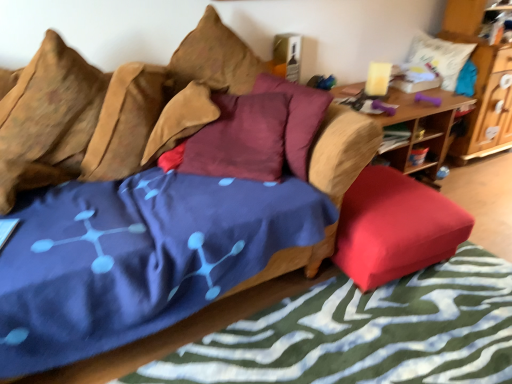
Question: Should I look upward or downward to see blue fabric mattress at center?

Choices:
 (A) down
 (B) up

Answer: (A)

Question: Is blue fabric bed frame at lower left positioned beyond the bounds of textured brown pillow at upper center, which is counted as the third pillow, starting from the right?

Choices:
 (A) no
 (B) yes

Answer: (B)

Question: From the image's perspective, is blue fabric bed frame at lower left beneath textured brown pillow at upper center, which is counted as the third pillow, starting from the right?

Choices:
 (A) yes
 (B) no

Answer: (A)

Question: Is blue fabric bed frame at lower left shorter than textured brown pillow at upper center, the second pillow in the left-to-right sequence?

Choices:
 (A) no
 (B) yes

Answer: (B)

Question: Would you consider blue fabric bed frame at lower left to be distant from textured brown pillow at upper center, the second pillow in the left-to-right sequence?

Choices:
 (A) yes
 (B) no

Answer: (A)

Question: Is blue fabric bed frame at lower left further to camera compared to textured brown pillow at upper center, the second pillow in the left-to-right sequence?

Choices:
 (A) yes
 (B) no

Answer: (B)

Question: Is blue fabric bed frame at lower left taller than textured brown pillow at upper center, which is counted as the third pillow, starting from the right?

Choices:
 (A) yes
 (B) no

Answer: (B)

Question: From a real-world perspective, is textured brown pillow at upper center, the second pillow in the left-to-right sequence, below wooden table at right?

Choices:
 (A) no
 (B) yes

Answer: (A)

Question: Considering the relative sizes of textured brown pillow at upper center, which is counted as the third pillow, starting from the right, and wooden table at right in the image provided, is textured brown pillow at upper center, which is counted as the third pillow, starting from the right, smaller than wooden table at right?

Choices:
 (A) no
 (B) yes

Answer: (B)

Question: From a real-world perspective, is textured brown pillow at upper center, the second pillow in the left-to-right sequence, positioned over wooden table at right based on gravity?

Choices:
 (A) yes
 (B) no

Answer: (A)

Question: From the image's perspective, is textured brown pillow at upper center, which is counted as the third pillow, starting from the right, on wooden table at right?

Choices:
 (A) no
 (B) yes

Answer: (B)

Question: Can you confirm if textured brown pillow at upper center, the second pillow in the left-to-right sequence, is positioned to the left of wooden table at right?

Choices:
 (A) yes
 (B) no

Answer: (A)

Question: Does textured brown pillow at upper center, which is counted as the third pillow, starting from the right, turn towards wooden table at right?

Choices:
 (A) yes
 (B) no

Answer: (B)

Question: From a real-world perspective, is velvet-like brown couch at center under blue fabric bed frame at lower left?

Choices:
 (A) yes
 (B) no

Answer: (B)